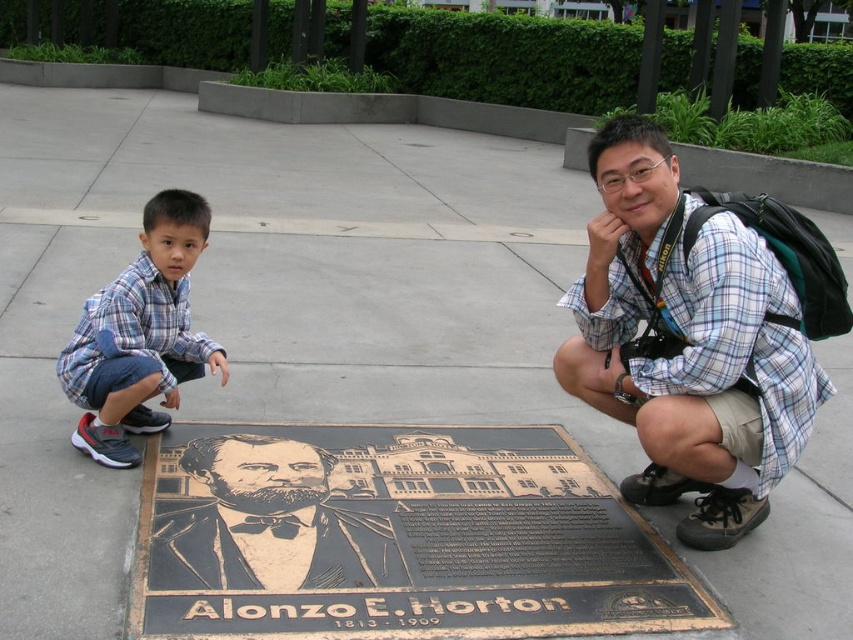
You are a photographer who needs to capture a photo of the matte bronze portrait at center and the blue plaid shirt at left in the same frame. Given that your camera has a maximum focus range of 25 inches, will both subjects be in focus?

The matte bronze portrait at center and the blue plaid shirt at left are 24.81 inches apart, which is within the camera maximum focus range of 25 inches. Therefore, both subjects will be in focus.